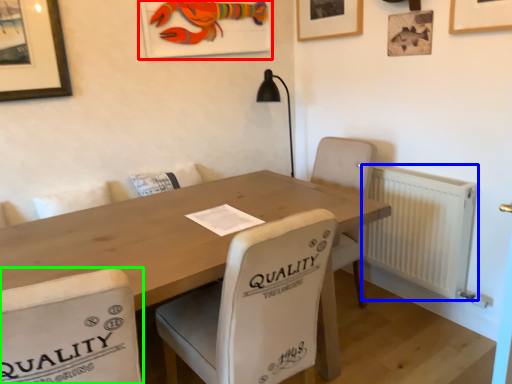
Question: Estimate the real-world distances between objects in this image. Which object is farther from picture frame (highlighted by a red box), radiator (highlighted by a blue box) or chair (highlighted by a green box)?

Choices:
 (A) radiator
 (B) chair

Answer: (B)